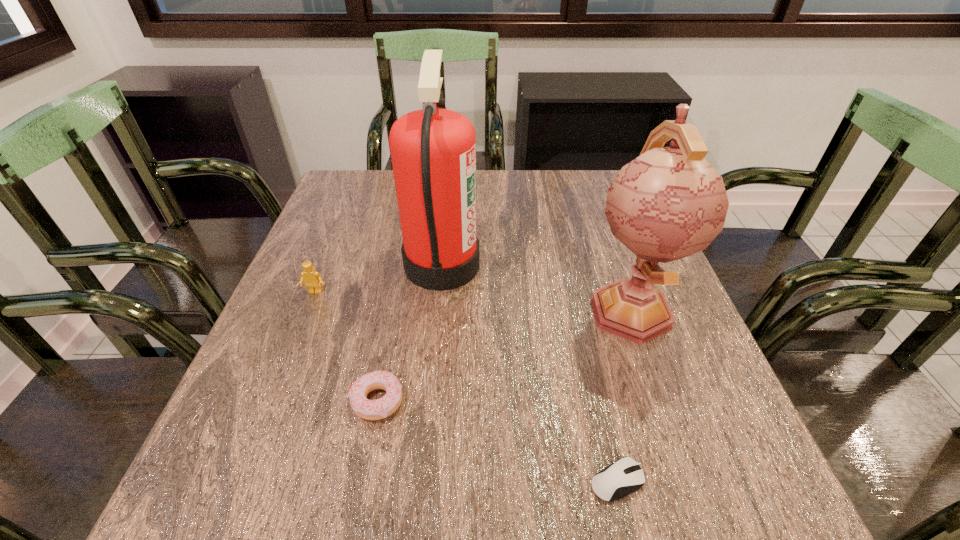
Where is `vacant region located 0.100m on the face of the leftmost object`? The image size is (960, 540). vacant region located 0.100m on the face of the leftmost object is located at coordinates (300, 332).

Where is `free space located on the back of the fourth farthest object`? The width and height of the screenshot is (960, 540). free space located on the back of the fourth farthest object is located at coordinates (402, 276).

Locate an element on the screen. free space located 0.070m on the left of the nearest object is located at coordinates (543, 481).

You are a GUI agent. You are given a task and a screenshot of the screen. Output one action in this format:
    pyautogui.click(x=<x>, y=<y>)
    Task: Click on the object at the near edge
    The height and width of the screenshot is (540, 960).
    Given the screenshot: What is the action you would take?
    pyautogui.click(x=625, y=476)

At what (x,y) coordinates should I click in order to perform the action: click on object that is positioned at the left edge. Please return your answer as a coordinate pair (x, y). This screenshot has width=960, height=540. Looking at the image, I should click on (313, 281).

Where is `object that is at the right edge`? The width and height of the screenshot is (960, 540). object that is at the right edge is located at coordinates (668, 203).

In the image, there is a desktop. Identify the location of vacant space at the near edge. (378, 502).

Find the location of a particular element. vacant region at the left edge of the desktop is located at coordinates 311,240.

The image size is (960, 540). I want to click on free location at the right edge, so click(613, 249).

Locate an element on the screen. This screenshot has width=960, height=540. free point at the far left corner is located at coordinates (391, 176).